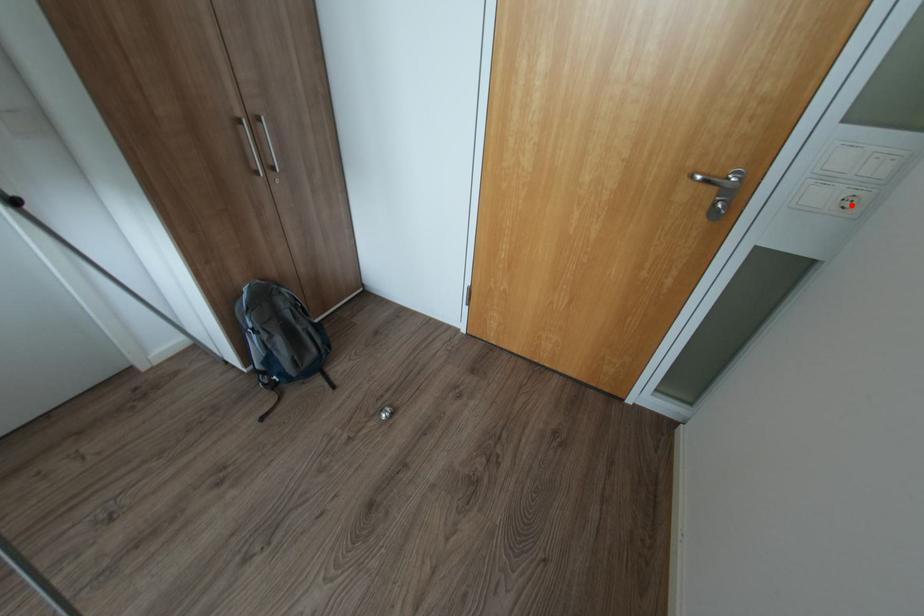
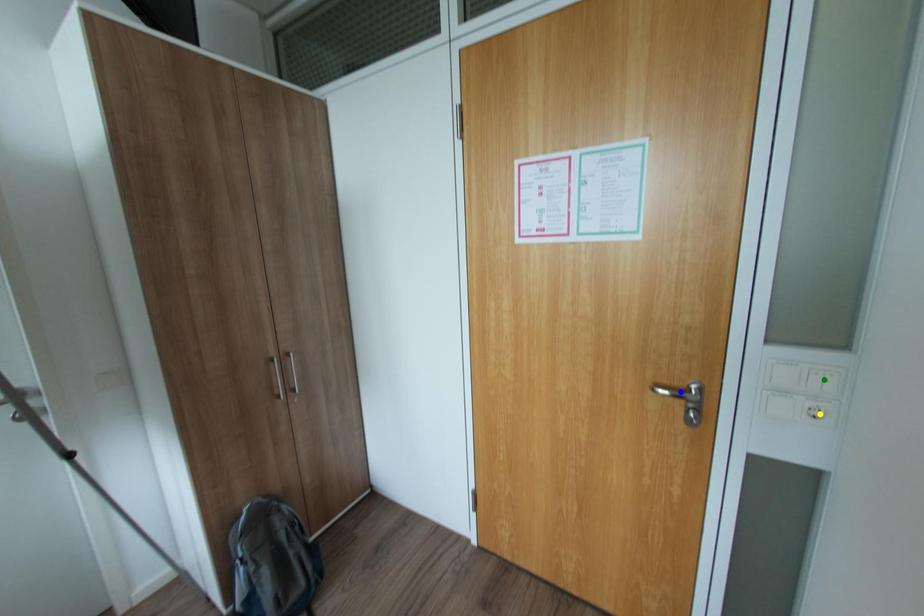
Question: I am providing you with two images of the same scene from different viewpoints. A red point is marked on the first image. You are given multiple points on the second image. Which point in image 2 represents the same 3d spot as the red point in image 1?

Choices:
 (A) blue point
 (B) yellow point
 (C) green point

Answer: (B)